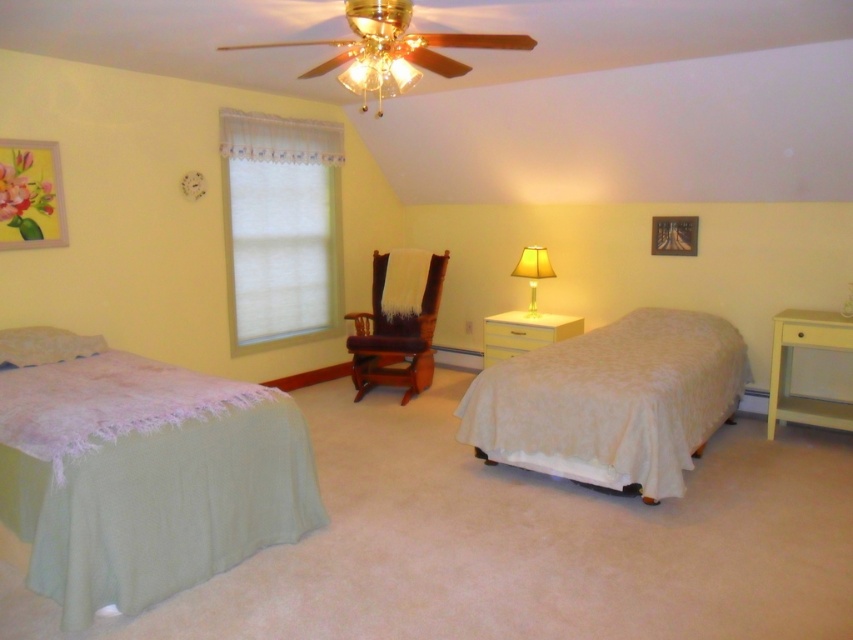
Question: Among these points, which one is farthest from the camera?

Choices:
 (A) (254, 138)
 (B) (584, 433)

Answer: (A)

Question: Among these points, which one is farthest from the camera?

Choices:
 (A) (0, 348)
 (B) (225, 493)
 (C) (241, 173)
 (D) (566, 394)

Answer: (C)

Question: Is white textured blinds at center positioned before white glossy dresser at center?

Choices:
 (A) no
 (B) yes

Answer: (B)

Question: Which point is farther to the camera?

Choices:
 (A) click(514, 273)
 (B) click(572, 316)
 (C) click(184, 465)

Answer: (B)

Question: Can you confirm if satin green bed at left is bigger than white textured bed at center?

Choices:
 (A) no
 (B) yes

Answer: (A)

Question: Can you confirm if white textured blinds at center is bigger than yellow fabric lampshade at upper right?

Choices:
 (A) no
 (B) yes

Answer: (B)